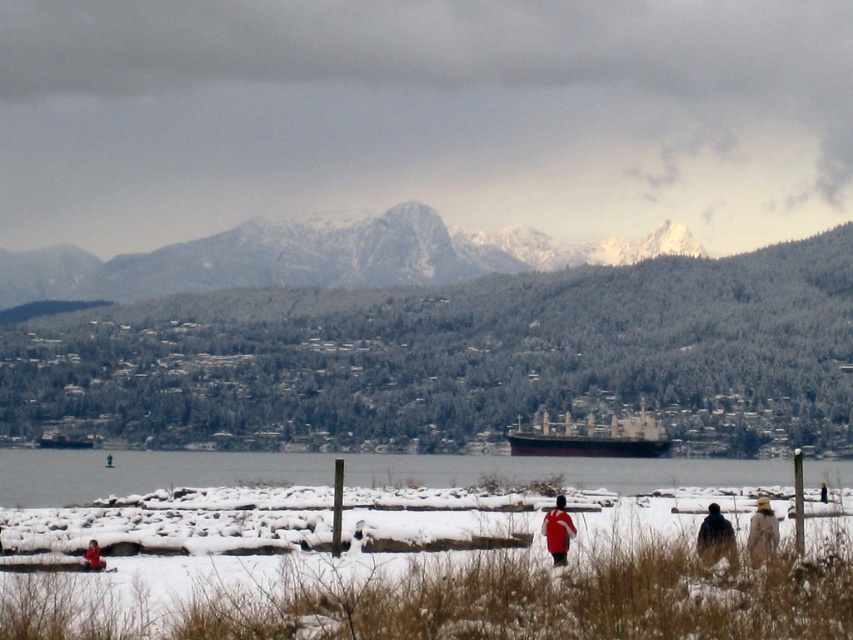
Question: Among these points, which one is farthest from the camera?

Choices:
 (A) (564, 532)
 (B) (653, 483)
 (C) (711, 307)
 (D) (722, 529)

Answer: (C)

Question: In this image, where is snowy granite mountain at upper center located relative to silhouette figure at lower right?

Choices:
 (A) right
 (B) left

Answer: (B)

Question: Does clear water at lower center have a larger size compared to gray metallic cargo ship at center?

Choices:
 (A) no
 (B) yes

Answer: (B)

Question: Which object is closer to the camera taking this photo?

Choices:
 (A) silhouette figure at lower right
 (B) white woolen coat at lower right
 (C) clear water at lower center

Answer: (B)

Question: Which of the following is the farthest from the observer?

Choices:
 (A) red matte jacket at lower center
 (B) snowy forested mountain at center
 (C) clear water at lower center

Answer: (B)

Question: Is snowy granite mountain at upper center to the right of clear water at lower center from the viewer's perspective?

Choices:
 (A) yes
 (B) no

Answer: (B)